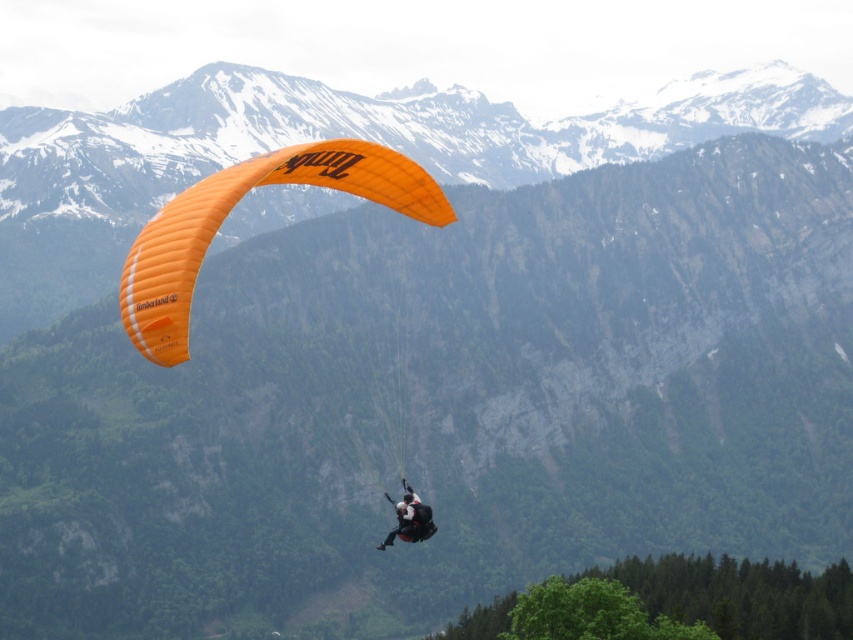
You are a photographer trying to capture the orange fabric parachute at center and the black fabric parachute at center in a single shot. Which parachute should you focus on first to ensure it appears larger in your photo?

The orange fabric parachute at center is bigger than the black fabric parachute at center, so focusing on the orange fabric parachute at center first will ensure it appears larger in the photo.

You are a pilot observing two parachutes in the sky. You see an orange fabric parachute at center and a black fabric parachute at center. Which parachute is higher in the sky?

The orange fabric parachute at center is much taller than the black fabric parachute at center, so the orange fabric parachute at center is higher in the sky.